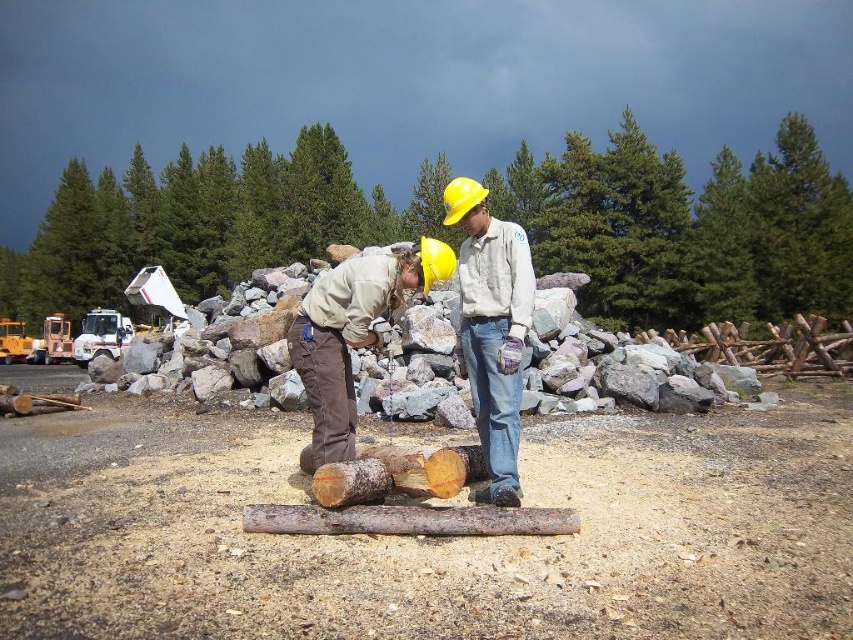
Is point (486, 403) farther from viewer compared to point (450, 490)?

Yes, point (486, 403) is farther from viewer.

Can you confirm if matte yellow hard hat at center is positioned to the left of wooden log at center?

No, matte yellow hard hat at center is not to the left of wooden log at center.

Between point (479, 260) and point (413, 456), which one is positioned behind?

Point (479, 260)

The image size is (853, 640). In order to click on matte yellow hard hat at center in this screenshot , I will do `click(492, 328)`.

Who is taller, matte khaki shirt at center or rusty wood log at center?

Standing taller between the two is matte khaki shirt at center.

Who is positioned more to the left, matte khaki shirt at center or rusty wood log at center?

matte khaki shirt at center

Which is in front, point (338, 355) or point (374, 531)?

Point (374, 531)

You are a GUI agent. You are given a task and a screenshot of the screen. Output one action in this format:
    pyautogui.click(x=<x>, y=<y>)
    Task: Click on the matte khaki shirt at center
    This screenshot has width=853, height=640.
    Given the screenshot: What is the action you would take?
    pyautogui.click(x=350, y=336)

Can you confirm if brown rough wood at center is bigger than matte yellow hard hat at center?

Yes.

The height and width of the screenshot is (640, 853). In order to click on brown rough wood at center in this screenshot , I will do `click(430, 540)`.

What are the coordinates of `brown rough wood at center` in the screenshot? It's located at click(x=430, y=540).